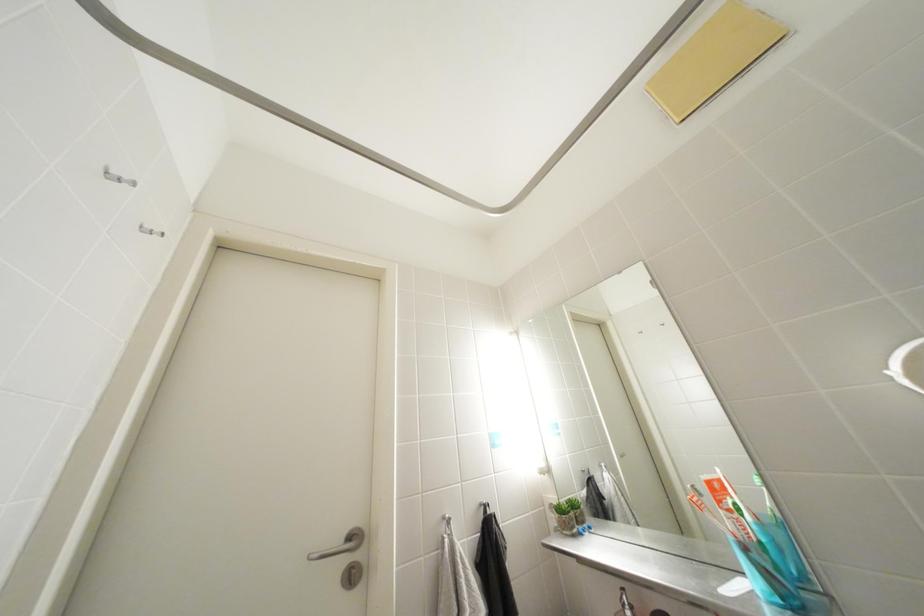
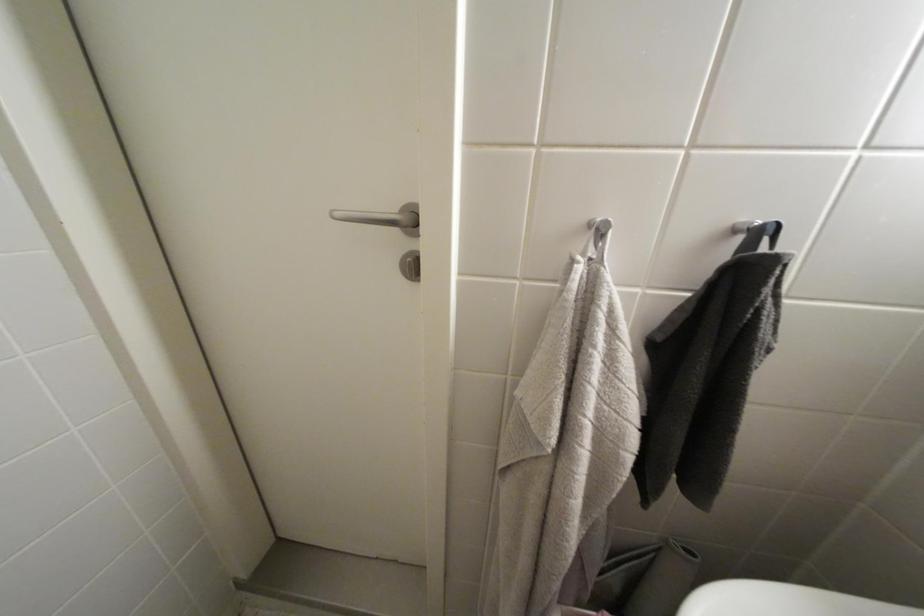
The first image is from the beginning of the video and the second image is from the end. How did the camera likely rotate when shooting the video?

The camera's rotation is toward left-down.